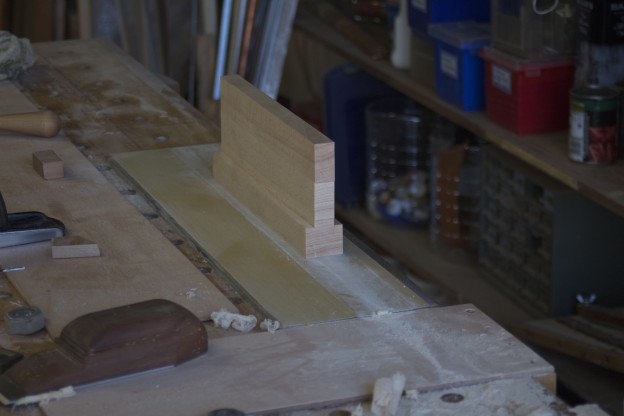
Image resolution: width=624 pixels, height=416 pixels. I want to click on wooden shelves, so click(x=358, y=58), click(x=414, y=260).